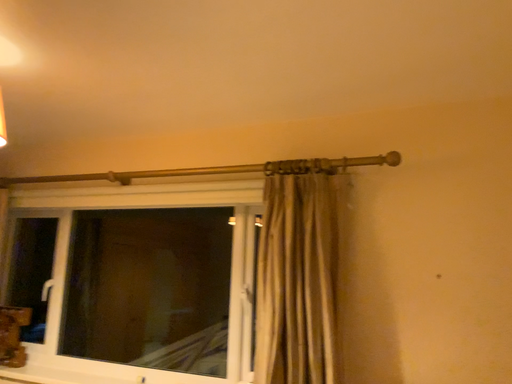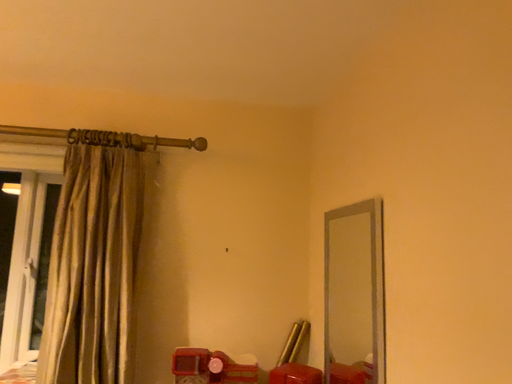
Question: How did the camera likely rotate when shooting the video?

Choices:
 (A) rotated right
 (B) rotated left

Answer: (A)